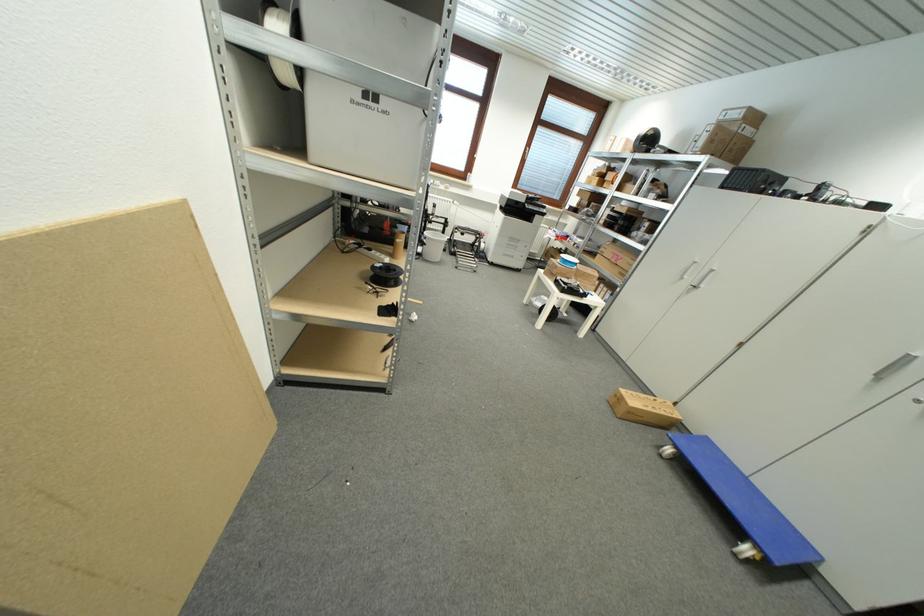
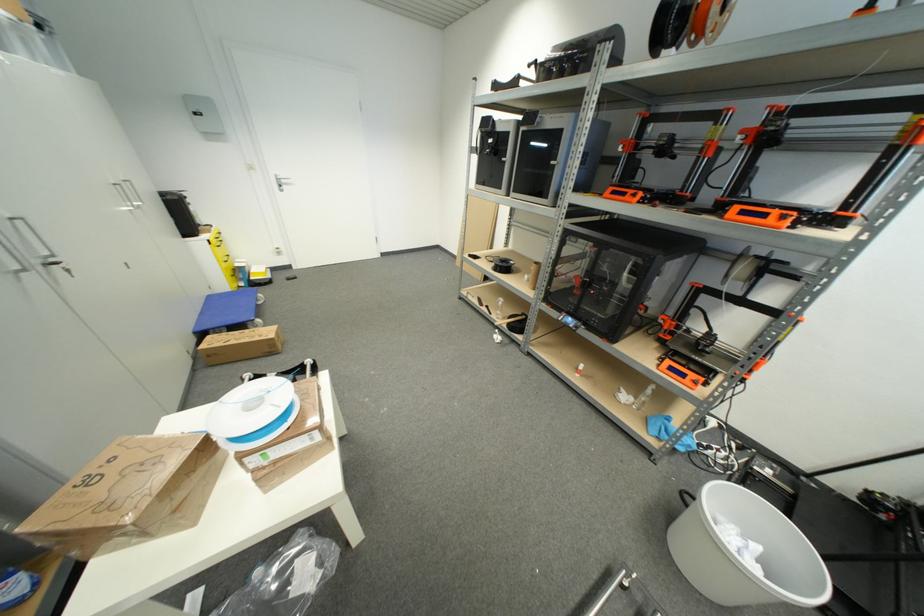
Locate, in the second image, the point that corresponds to the point at 824,561 in the first image.

(213, 299)